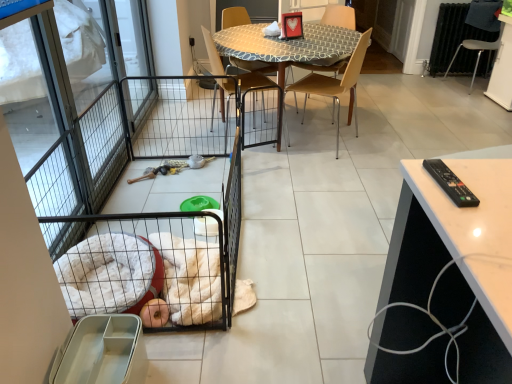
Locate an element on the screen. Image resolution: width=512 pixels, height=384 pixels. vacant area that lies between light brown plastic chair at center, the 3th chair when ordered from right to left, and black wire pet cage at left is located at coordinates (295, 188).